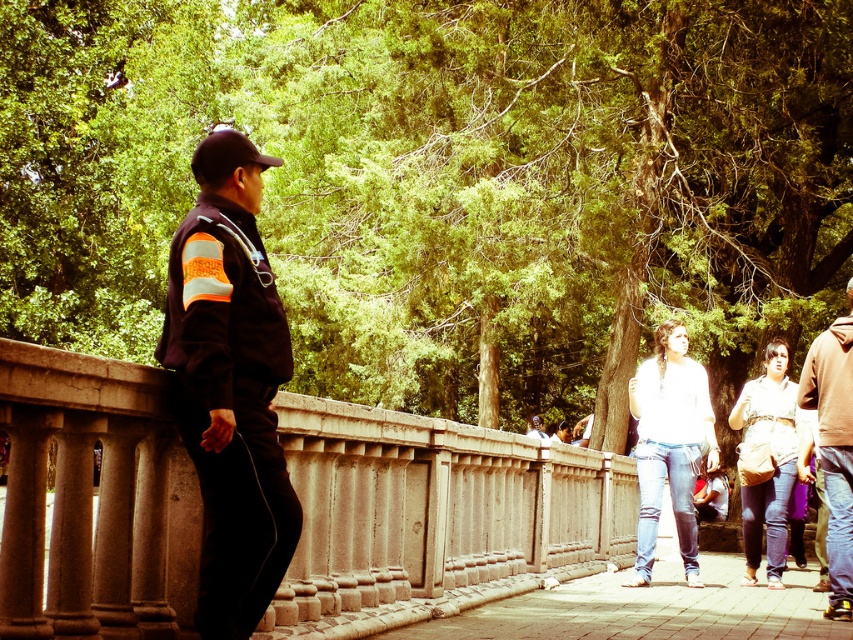
Question: Does smooth concrete railing at center come behind brown leather jacket at right?

Choices:
 (A) yes
 (B) no

Answer: (B)

Question: Which of these objects is positioned closest to the paved stone sidewalk at center?

Choices:
 (A) brown leather jacket at right
 (B) smooth concrete railing at center

Answer: (B)

Question: Which point is closer to the camera?

Choices:
 (A) brown leather jacket at right
 (B) paved stone sidewalk at center
 (C) dark blue uniform at left

Answer: (C)

Question: Where is dark blue uniform at left located in relation to paved stone sidewalk at center in the image?

Choices:
 (A) left
 (B) right

Answer: (A)

Question: Which is farther from the smooth concrete railing at center?

Choices:
 (A) paved stone sidewalk at center
 (B) brown leather jacket at right

Answer: (B)

Question: Does dark blue uniform at left appear on the left side of brown leather jacket at right?

Choices:
 (A) yes
 (B) no

Answer: (A)